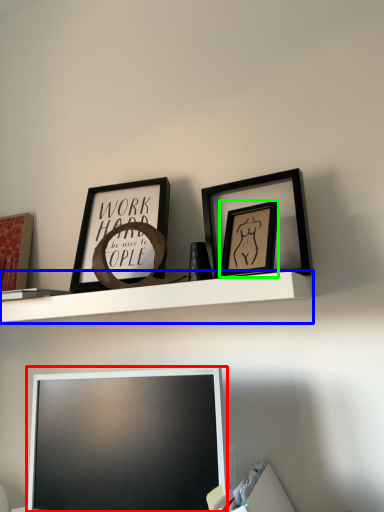
Question: Which object is positioned farthest from television (highlighted by a red box)? Select from shelf (highlighted by a blue box) and picture frame (highlighted by a green box).

Choices:
 (A) shelf
 (B) picture frame

Answer: (B)